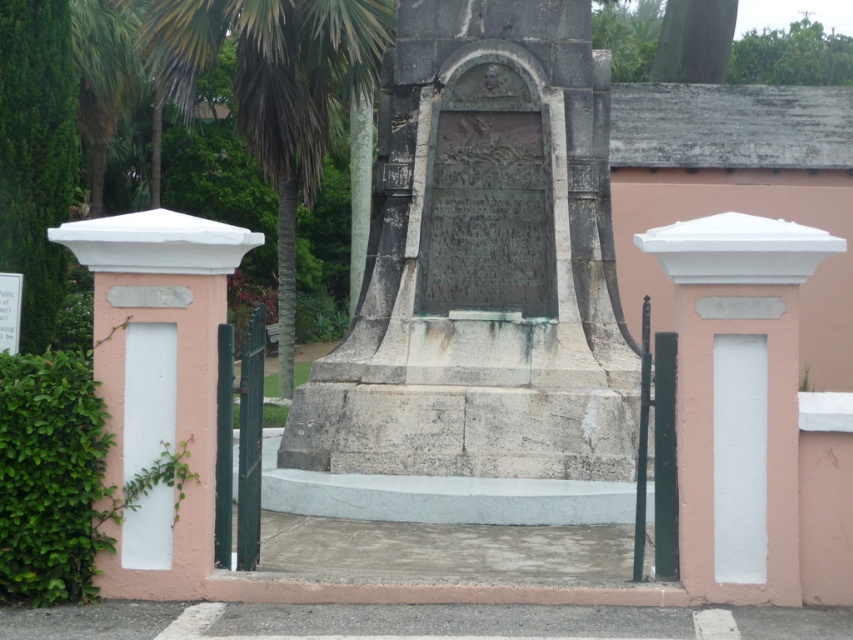
You are a landscape architect designing a walking path between the gray stone monument at center and the green leafy palm tree at center. The path must be straight and at least 1 meter wide. Can you fit the path between them without any obstacles?

The gray stone monument at center and green leafy palm tree at center are 6.27 meters apart from each other. Since the path only needs to be 1 meter wide, there is sufficient space to create a straight path between them without any obstacles.

In the scene shown: You are standing in front of the gray stone monument at center and the green leafy palm tree at center. Which object is positioned more to the left?

The green leafy palm tree at center is positioned more to the left than the gray stone monument at center.

You are standing at the point with coordinates point (x=483, y=262). According to the image, what object are you standing on?

The point (x=483, y=262) corresponds to the gray stone monument at center, so you are standing on the gray stone monument at center.